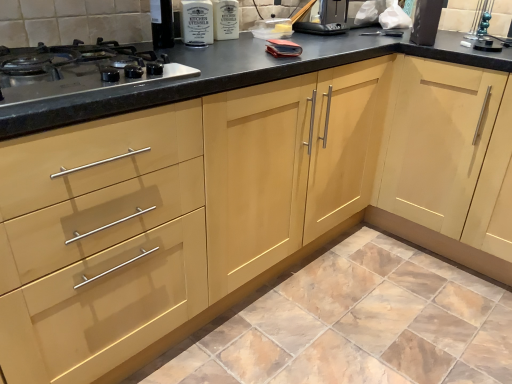
Question: Can you confirm if black matte toaster at upper right, acting as the first appliance starting from the right, is smaller than stainless steel gas stove at left?

Choices:
 (A) yes
 (B) no

Answer: (A)

Question: Is stainless steel gas stove at left surrounded by black matte toaster at upper right, which is counted as the 2th appliance, starting from the back?

Choices:
 (A) no
 (B) yes

Answer: (A)

Question: Is black matte toaster at upper right, which is counted as the first appliance, starting from the front, aimed at stainless steel gas stove at left?

Choices:
 (A) yes
 (B) no

Answer: (B)

Question: Is black matte toaster at upper right, acting as the 2th appliance starting from the left, to the right of stainless steel gas stove at left from the viewer's perspective?

Choices:
 (A) no
 (B) yes

Answer: (B)

Question: Does black matte toaster at upper right, acting as the 2th appliance starting from the left, have a larger size compared to stainless steel gas stove at left?

Choices:
 (A) yes
 (B) no

Answer: (B)

Question: Is black matte toaster at upper right, which is counted as the 2th appliance, starting from the back, with stainless steel gas stove at left?

Choices:
 (A) no
 (B) yes

Answer: (A)

Question: Are light wood cabinet at center and black plastic toaster at upper center, positioned as the 2th appliance in front-to-back order, far apart?

Choices:
 (A) yes
 (B) no

Answer: (B)

Question: Is light wood cabinet at center positioned before black plastic toaster at upper center, which appears as the 2th appliance when viewed from the right?

Choices:
 (A) no
 (B) yes

Answer: (B)

Question: Does light wood cabinet at center have a larger size compared to black plastic toaster at upper center, the 1th appliance viewed from the left?

Choices:
 (A) yes
 (B) no

Answer: (A)

Question: Is light wood cabinet at center at the right side of black plastic toaster at upper center, positioned as the 1th appliance in back-to-front order?

Choices:
 (A) yes
 (B) no

Answer: (A)

Question: From a real-world perspective, is light wood cabinet at center positioned under black plastic toaster at upper center, positioned as the 1th appliance in back-to-front order, based on gravity?

Choices:
 (A) no
 (B) yes

Answer: (B)

Question: Is the position of light wood cabinet at center more distant than that of black plastic toaster at upper center, the 1th appliance viewed from the left?

Choices:
 (A) no
 (B) yes

Answer: (A)

Question: Is matte ceramic tile at lower center touching black plastic toaster at upper center, which appears as the 2th appliance when viewed from the right?

Choices:
 (A) no
 (B) yes

Answer: (A)